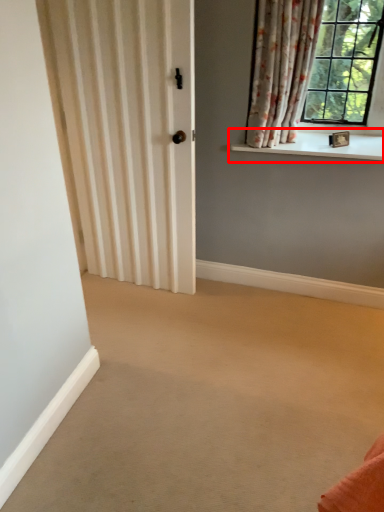
Question: From the image's perspective, what is the correct spatial positioning of window sill (annotated by the red box) in reference to curtain?

Choices:
 (A) below
 (B) above

Answer: (A)